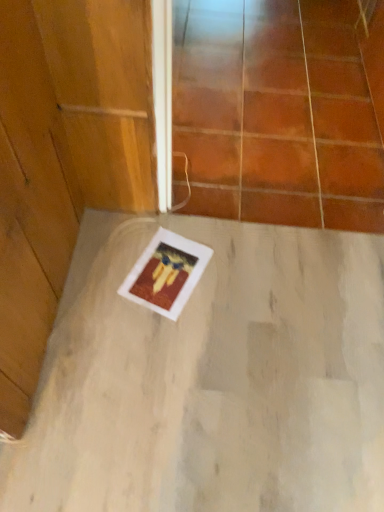
Question: Would you say transparent glass door at upper center contains white matte concrete at center?

Choices:
 (A) yes
 (B) no

Answer: (B)

Question: Can you confirm if transparent glass door at upper center is positioned to the left of white matte concrete at center?

Choices:
 (A) yes
 (B) no

Answer: (B)

Question: Does transparent glass door at upper center lie behind white matte concrete at center?

Choices:
 (A) yes
 (B) no

Answer: (A)

Question: Is transparent glass door at upper center smaller than white matte concrete at center?

Choices:
 (A) yes
 (B) no

Answer: (B)

Question: From the image's perspective, does transparent glass door at upper center appear higher than white matte concrete at center?

Choices:
 (A) yes
 (B) no

Answer: (A)

Question: Is transparent glass door at upper center thinner than white matte concrete at center?

Choices:
 (A) yes
 (B) no

Answer: (B)

Question: Is white matte concrete at center positioned before transparent glass door at upper center?

Choices:
 (A) yes
 (B) no

Answer: (A)

Question: Is white matte concrete at center positioned with its back to transparent glass door at upper center?

Choices:
 (A) no
 (B) yes

Answer: (A)

Question: Is white matte concrete at center directly adjacent to transparent glass door at upper center?

Choices:
 (A) yes
 (B) no

Answer: (B)

Question: Can you confirm if white matte concrete at center is thinner than transparent glass door at upper center?

Choices:
 (A) yes
 (B) no

Answer: (A)

Question: Does white matte concrete at center have a greater height compared to transparent glass door at upper center?

Choices:
 (A) yes
 (B) no

Answer: (A)

Question: Is white matte concrete at center shorter than transparent glass door at upper center?

Choices:
 (A) yes
 (B) no

Answer: (B)

Question: Is point (342, 159) positioned closer to the camera than point (18, 499)?

Choices:
 (A) closer
 (B) farther

Answer: (B)